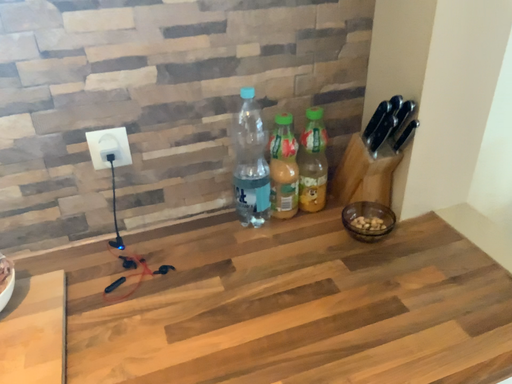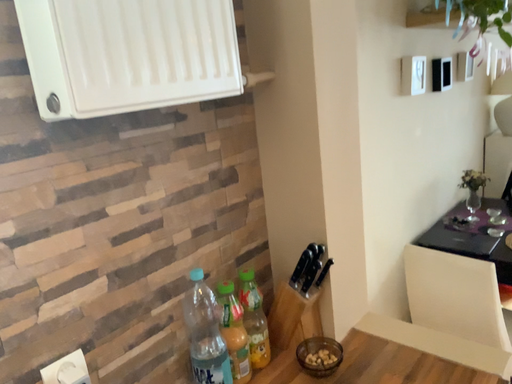
Question: Which way did the camera rotate in the video?

Choices:
 (A) rotated left
 (B) rotated right

Answer: (B)